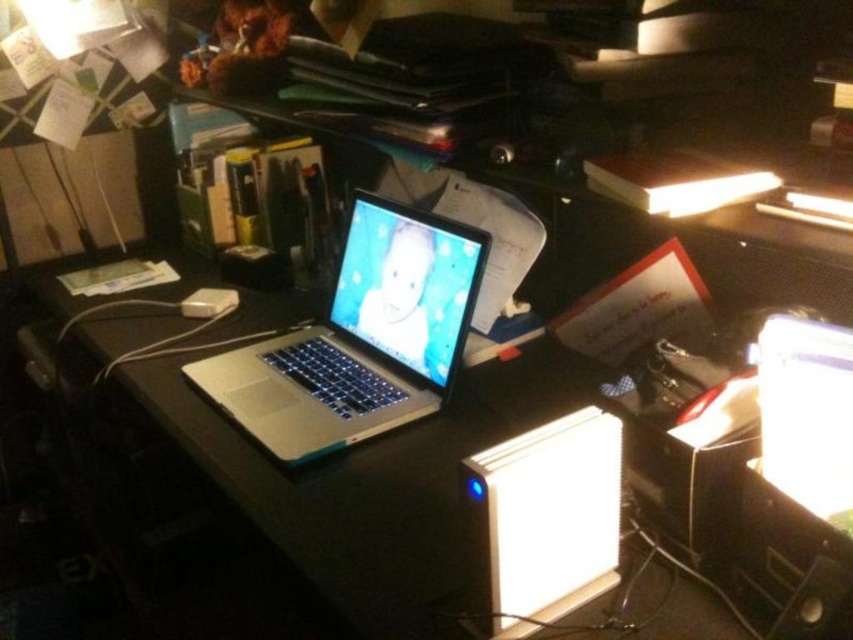
You are a delivery robot standing 1.5 meters away from the desk. You need to place a package on the silver metallic laptop at center. Can you reach it?

The silver metallic laptop at center is 1.09 meters away from camera. Since the robot is standing 1.5 meters away from the desk, the total distance to the laptop would be more than 1.09 meters. Therefore, the robot cannot reach the laptop to place the package.